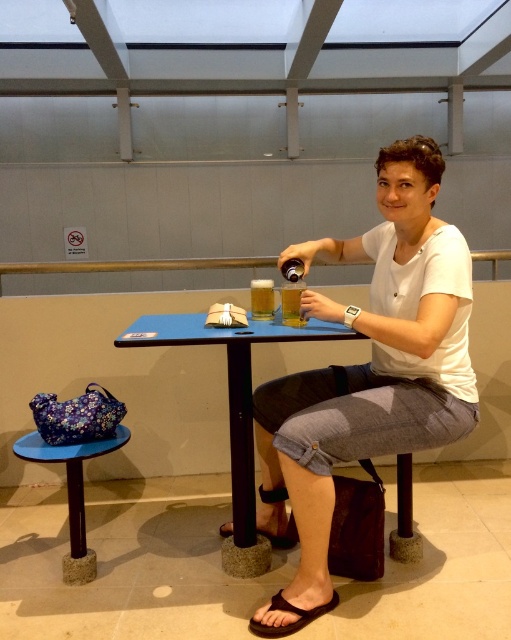
Question: Which object is positioned closest to the blue plastic table at center?

Choices:
 (A) white cotton shirt at center
 (B) translucent glass beer at center
 (C) blue fabric table at lower left
 (D) translucent glass beer at table center

Answer: (A)

Question: Is brown leather sandal at lower center bigger than translucent glass beer at center?

Choices:
 (A) yes
 (B) no

Answer: (B)

Question: In this image, where is brown leather sandal at lower center located relative to black rubber sandal at lower center?

Choices:
 (A) below
 (B) above

Answer: (A)

Question: Is brown leather sandal at lower center closer to camera compared to translucent glass beer at center?

Choices:
 (A) no
 (B) yes

Answer: (B)

Question: Which point is closer to the camera taking this photo?

Choices:
 (A) (227, 532)
 (B) (290, 305)

Answer: (B)

Question: Which of the following is the farthest from the observer?

Choices:
 (A) brown leather sandal at lower center
 (B) blue plastic table at center
 (C) translucent glass beer at center
 (D) blue fabric table at lower left

Answer: (D)